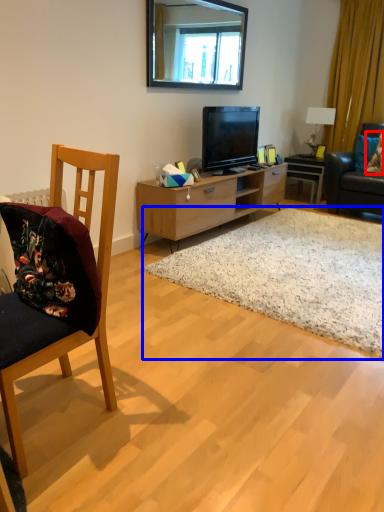
Question: Among these objects, which one is farthest to the camera, pillow (highlighted by a red box) or plain (highlighted by a blue box)?

Choices:
 (A) pillow
 (B) plain

Answer: (A)